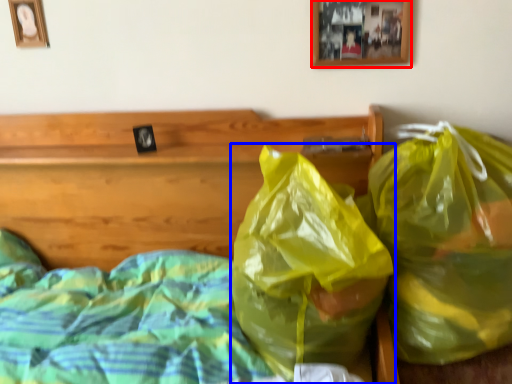
Question: Which of the following is the closest to the observer, picture frame (highlighted by a red box) or plastic bag (highlighted by a blue box)?

Choices:
 (A) picture frame
 (B) plastic bag

Answer: (B)